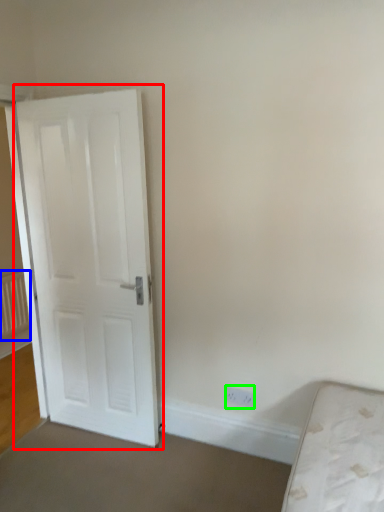
Question: Which object is positioned closest to door (highlighted by a red box)? Select from radiator (highlighted by a blue box) and electric outlet (highlighted by a green box).

Choices:
 (A) radiator
 (B) electric outlet

Answer: (B)